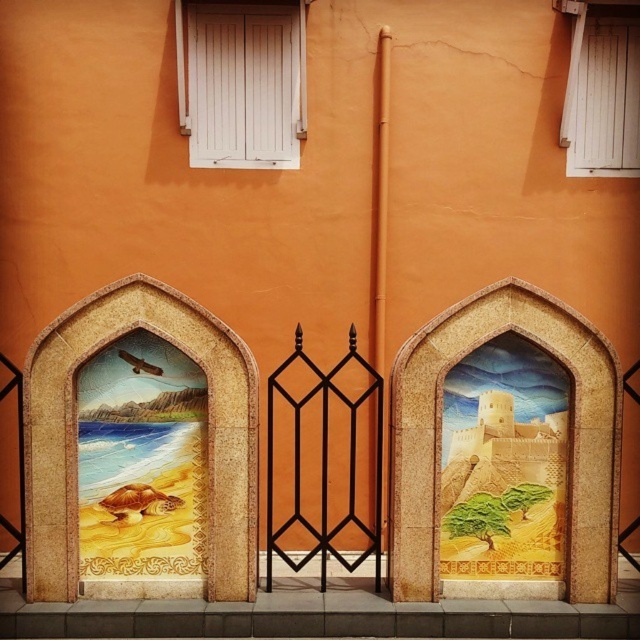
Question: Which object is positioned farthest from the white wood window at upper right?

Choices:
 (A) white painted wood at upper center
 (B) black wrought iron gate at center
 (C) golden sandcastle at right

Answer: (C)

Question: Is white painted wood at upper center thinner than black wrought iron gate at center?

Choices:
 (A) no
 (B) yes

Answer: (A)

Question: Is golden sandcastle at right thinner than white painted wood at upper center?

Choices:
 (A) no
 (B) yes

Answer: (B)

Question: Which point is closer to the camera taking this photo?

Choices:
 (A) (637, 68)
 (B) (248, 113)

Answer: (B)

Question: Does white painted wood at upper center appear on the right side of white wood window at upper right?

Choices:
 (A) yes
 (B) no

Answer: (B)

Question: Which is nearer to the black wrought iron gate at center?

Choices:
 (A) white painted wood at upper center
 (B) golden sandcastle at right

Answer: (B)